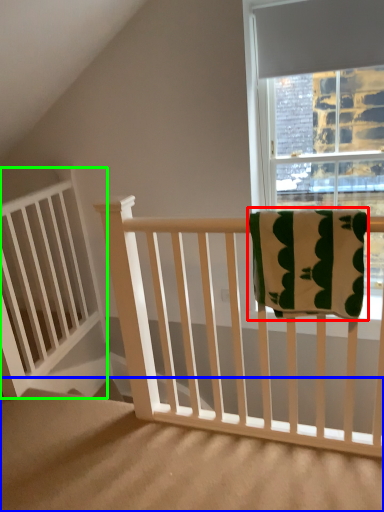
Question: Considering the real-world distances, which object is farthest from beach towel (highlighted by a red box)? stairs (highlighted by a blue box) or balustrade (highlighted by a green box)?

Choices:
 (A) stairs
 (B) balustrade

Answer: (B)